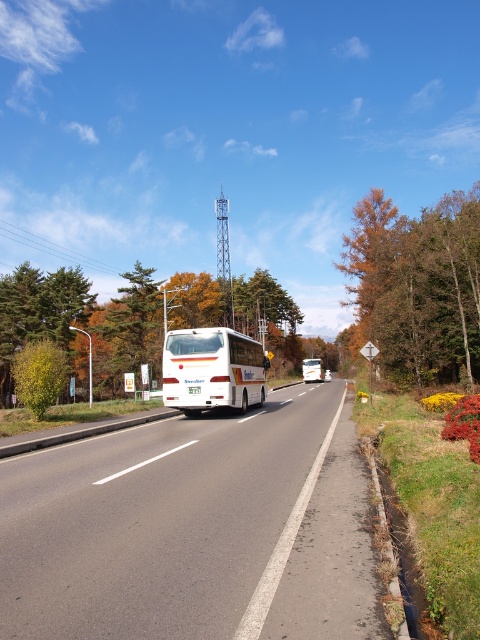
Question: In this image, where is white asphalt highway at center located relative to orange matte tree at right?

Choices:
 (A) right
 (B) left

Answer: (B)

Question: Estimate the real-world distances between objects in this image. Which object is closer to the white asphalt highway at center?

Choices:
 (A) white glossy bus at center
 (B) white matte bus at center
 (C) orange matte tree at right

Answer: (A)

Question: Which object is positioned farthest from the orange matte tree at right?

Choices:
 (A) white glossy bus at center
 (B) white matte bus at center
 (C) white asphalt highway at center

Answer: (C)

Question: Can you confirm if orange matte tree at right is positioned below white glossy bus at center?

Choices:
 (A) yes
 (B) no

Answer: (B)

Question: Which is farther from the white glossy bus at center?

Choices:
 (A) white matte bus at center
 (B) orange matte tree at right
 (C) white asphalt highway at center

Answer: (A)

Question: Can you confirm if orange matte tree at right is wider than white glossy bus at center?

Choices:
 (A) yes
 (B) no

Answer: (A)